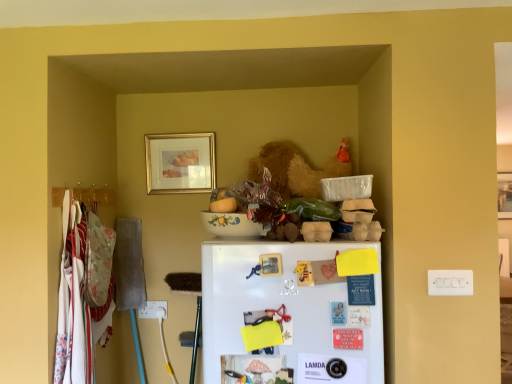
Question: From a real-world perspective, is gold-framed picture at upper center, which is the 1th picture frame from left to right, positioned above or below wooden picture frame at upper right, positioned as the second picture frame in left-to-right order?

Choices:
 (A) above
 (B) below

Answer: (A)

Question: Is point (162, 183) positioned closer to the camera than point (504, 198)?

Choices:
 (A) closer
 (B) farther

Answer: (A)

Question: Which object is positioned closest to the white matte refrigerator at center?

Choices:
 (A) wooden picture frame at upper right, the 1th picture frame in the back-to-front sequence
 (B) gold-framed picture at upper center, arranged as the 2th picture frame when viewed from the back

Answer: (B)

Question: Based on their relative distances, which object is farther from the gold-framed picture at upper center, arranged as the 2th picture frame when viewed from the back?

Choices:
 (A) wooden picture frame at upper right, the 1th picture frame in the back-to-front sequence
 (B) white matte refrigerator at center

Answer: (A)